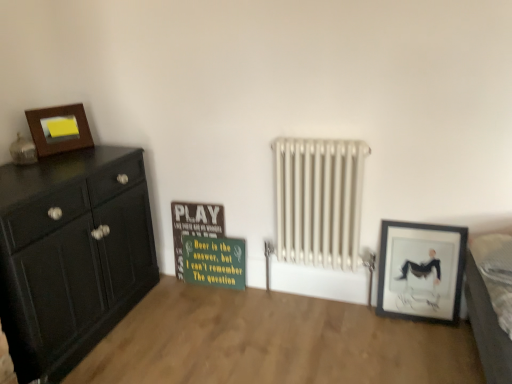
What do you see at coordinates (59, 129) in the screenshot? Image resolution: width=512 pixels, height=384 pixels. I see `matte wooden picture frame at upper left, placed as the second picture frame when sorted from right to left` at bounding box center [59, 129].

What do you see at coordinates (486, 316) in the screenshot? I see `gray fabric bed at lower right` at bounding box center [486, 316].

The width and height of the screenshot is (512, 384). What do you see at coordinates (194, 226) in the screenshot?
I see `wooden signboard at center` at bounding box center [194, 226].

Where is `matte wooden picture frame at upper left, the 2th picture frame from the bottom`? matte wooden picture frame at upper left, the 2th picture frame from the bottom is located at coordinates [59, 129].

In the scene shown: Is matte black picture frame at lower right, which ranks as the 2th picture frame in left-to-right order, inside matte black cabinet at left?

No, matte black picture frame at lower right, which ranks as the 2th picture frame in left-to-right order, is not inside matte black cabinet at left.

Based on the photo, considering the positions of objects matte black cabinet at left and matte black picture frame at lower right, the 1th picture frame when ordered from bottom to top, in the image provided, who is more to the left, matte black cabinet at left or matte black picture frame at lower right, the 1th picture frame when ordered from bottom to top,?

Positioned to the left is matte black cabinet at left.

Is matte black cabinet at left directly adjacent to matte black picture frame at lower right, which ranks as the first picture frame in right-to-left order?

matte black cabinet at left and matte black picture frame at lower right, which ranks as the first picture frame in right-to-left order, are clearly separated.

Which object is positioned more to the right, matte black picture frame at lower right, which is counted as the 2th picture frame, starting from the top, or matte black cabinet at left?

Positioned to the right is matte black picture frame at lower right, which is counted as the 2th picture frame, starting from the top.

From the image's perspective, relative to matte black cabinet at left, is matte black picture frame at lower right, which ranks as the first picture frame in right-to-left order, above or below?

Based on their image positions, matte black picture frame at lower right, which ranks as the first picture frame in right-to-left order, is located beneath matte black cabinet at left.

Is matte black picture frame at lower right, the 1th picture frame when ordered from bottom to top, not close to matte black cabinet at left?

Yes.

From the picture: In terms of size, does matte black picture frame at lower right, which is counted as the 2th picture frame, starting from the top, appear bigger or smaller than matte black cabinet at left?

Clearly, matte black picture frame at lower right, which is counted as the 2th picture frame, starting from the top, is smaller in size than matte black cabinet at left.

Looking at this image, is matte black picture frame at lower right, which is counted as the 2th picture frame, starting from the top, to the right of gray fabric bed at lower right from the viewer's perspective?

No.

Is matte black picture frame at lower right, which ranks as the 2th picture frame in left-to-right order, surrounding gray fabric bed at lower right?

Actually, gray fabric bed at lower right is outside matte black picture frame at lower right, which ranks as the 2th picture frame in left-to-right order.

Does matte black picture frame at lower right, which ranks as the first picture frame in right-to-left order, have a greater height compared to gray fabric bed at lower right?

Yes.

Between point (423, 270) and point (506, 334), which one is positioned behind?

The point (423, 270) is farther.

Could you tell me if white metallic radiator at center is facing matte wooden picture frame at upper left, placed as the first picture frame when sorted from top to bottom?

No, white metallic radiator at center is not oriented towards matte wooden picture frame at upper left, placed as the first picture frame when sorted from top to bottom.

Between white metallic radiator at center and matte wooden picture frame at upper left, which is the first picture frame in left-to-right order, which one has smaller size?

matte wooden picture frame at upper left, which is the first picture frame in left-to-right order, is smaller.

Which object is wider, white metallic radiator at center or matte wooden picture frame at upper left, placed as the second picture frame when sorted from right to left?

white metallic radiator at center.

Considering the positions of objects white metallic radiator at center and matte wooden picture frame at upper left, placed as the second picture frame when sorted from right to left, in the image provided, who is more to the right, white metallic radiator at center or matte wooden picture frame at upper left, placed as the second picture frame when sorted from right to left,?

white metallic radiator at center.

From the image's perspective, is white metallic radiator at center located above or below matte black picture frame at lower right, which ranks as the 2th picture frame in left-to-right order?

white metallic radiator at center is above matte black picture frame at lower right, which ranks as the 2th picture frame in left-to-right order.

Between white metallic radiator at center and matte black picture frame at lower right, which ranks as the first picture frame in right-to-left order, which one appears on the right side from the viewer's perspective?

matte black picture frame at lower right, which ranks as the first picture frame in right-to-left order, is more to the right.

From the picture: Who is bigger, white metallic radiator at center or matte black picture frame at lower right, which ranks as the first picture frame in right-to-left order?

Bigger between the two is white metallic radiator at center.

Looking at their sizes, would you say white metallic radiator at center is wider or thinner than matte black picture frame at lower right, which is counted as the 2th picture frame, starting from the top?

Clearly, white metallic radiator at center has more width compared to matte black picture frame at lower right, which is counted as the 2th picture frame, starting from the top.

Is gray fabric bed at lower right at the left side of matte wooden picture frame at upper left, the 2th picture frame from the bottom?

No, gray fabric bed at lower right is not to the left of matte wooden picture frame at upper left, the 2th picture frame from the bottom.

Is matte wooden picture frame at upper left, placed as the second picture frame when sorted from right to left, at the back of gray fabric bed at lower right?

No.

Which is in front, point (490, 360) or point (73, 141)?

The point (490, 360) is more forward.

From the image's perspective, is gray fabric bed at lower right located above or below matte wooden picture frame at upper left, placed as the second picture frame when sorted from right to left?

gray fabric bed at lower right is below matte wooden picture frame at upper left, placed as the second picture frame when sorted from right to left.

Can you tell me how much matte black picture frame at lower right, which is counted as the 2th picture frame, starting from the top, and matte wooden picture frame at upper left, placed as the second picture frame when sorted from right to left, differ in facing direction?

They differ by 63.5 degrees in their facing directions.

Where is `picture frame lying on the left of matte black picture frame at lower right, which ranks as the first picture frame in right-to-left order`? The width and height of the screenshot is (512, 384). picture frame lying on the left of matte black picture frame at lower right, which ranks as the first picture frame in right-to-left order is located at coordinates (59, 129).

Is matte black picture frame at lower right, the 1th picture frame when ordered from bottom to top, surrounding matte wooden picture frame at upper left, placed as the first picture frame when sorted from top to bottom?

No, matte wooden picture frame at upper left, placed as the first picture frame when sorted from top to bottom, is not a part of matte black picture frame at lower right, the 1th picture frame when ordered from bottom to top.

From the picture: Considering the relative positions of matte black picture frame at lower right, which is counted as the 2th picture frame, starting from the top, and matte wooden picture frame at upper left, which is the first picture frame in left-to-right order, in the image provided, is matte black picture frame at lower right, which is counted as the 2th picture frame, starting from the top, to the left or to the right of matte wooden picture frame at upper left, which is the first picture frame in left-to-right order,?

In the image, matte black picture frame at lower right, which is counted as the 2th picture frame, starting from the top, appears on the right side of matte wooden picture frame at upper left, which is the first picture frame in left-to-right order.

Find the location of a particular element. Image resolution: width=512 pixels, height=384 pixels. chest of drawers above the matte black picture frame at lower right, which ranks as the 2th picture frame in left-to-right order (from the image's perspective) is located at coordinates (72, 254).

The image size is (512, 384). I want to click on picture frame that is below the matte black cabinet at left (from the image's perspective), so click(421, 271).

Which object lies nearer to the anchor point matte black picture frame at lower right, which is counted as the 2th picture frame, starting from the top, gray fabric bed at lower right or matte black cabinet at left?

Based on the image, gray fabric bed at lower right appears to be nearer to matte black picture frame at lower right, which is counted as the 2th picture frame, starting from the top.

From the image, which object appears to be farther from gray fabric bed at lower right, matte wooden picture frame at upper left, the 2th picture frame from the bottom, or wooden signboard at center?

Among the two, matte wooden picture frame at upper left, the 2th picture frame from the bottom, is located further to gray fabric bed at lower right.

When comparing their distances from green matte signboard at center, does matte black cabinet at left or matte wooden picture frame at upper left, which is the first picture frame in left-to-right order, seem closer?

Among the two, matte black cabinet at left is located nearer to green matte signboard at center.

Considering their positions, is matte black cabinet at left positioned closer to matte black picture frame at lower right, which ranks as the first picture frame in right-to-left order, than matte wooden picture frame at upper left, placed as the first picture frame when sorted from top to bottom?

The object closer to matte black picture frame at lower right, which ranks as the first picture frame in right-to-left order, is matte black cabinet at left.

Considering their positions, is matte black picture frame at lower right, which ranks as the 2th picture frame in left-to-right order, positioned further to gray fabric bed at lower right than matte black cabinet at left?

Based on the image, matte black cabinet at left appears to be further to gray fabric bed at lower right.

Which object lies further to the anchor point matte wooden picture frame at upper left, the 2th picture frame from the bottom, wooden signboard at center or white metallic radiator at center?

Based on the image, white metallic radiator at center appears to be further to matte wooden picture frame at upper left, the 2th picture frame from the bottom.

Which object lies further to the anchor point white metallic radiator at center, gray fabric bed at lower right or matte black cabinet at left?

The object further to white metallic radiator at center is matte black cabinet at left.

Which object lies nearer to the anchor point green matte signboard at center, matte black picture frame at lower right, which ranks as the 2th picture frame in left-to-right order, or matte black cabinet at left?

Answer: matte black cabinet at left.

You are a GUI agent. You are given a task and a screenshot of the screen. Output one action in this format:
    pyautogui.click(x=<x>, y=<y>)
    Task: Click on the chest of drawers between matte wooden picture frame at upper left, which is the first picture frame in left-to-right order, and matte black picture frame at lower right, which ranks as the 2th picture frame in left-to-right order, from left to right
    The width and height of the screenshot is (512, 384).
    Given the screenshot: What is the action you would take?
    pyautogui.click(x=72, y=254)

Image resolution: width=512 pixels, height=384 pixels. Identify the location of bulletin board between matte black cabinet at left and matte black picture frame at lower right, the 1th picture frame when ordered from bottom to top, from left to right. (194, 226).

The image size is (512, 384). I want to click on radiator located between matte black cabinet at left and gray fabric bed at lower right in the left-right direction, so click(319, 201).

This screenshot has height=384, width=512. Identify the location of picture frame situated between matte black cabinet at left and gray fabric bed at lower right from left to right. (421, 271).